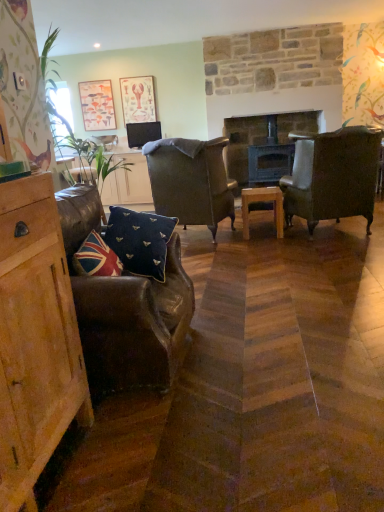
This screenshot has width=384, height=512. Find the location of `leather armchair at center, which appears as the 2th chair when viewed from the front`. leather armchair at center, which appears as the 2th chair when viewed from the front is located at coordinates (332, 175).

Locate an element on the screen. The width and height of the screenshot is (384, 512). dark wood fireplace at center is located at coordinates (242, 143).

The height and width of the screenshot is (512, 384). In order to click on union jack fabric pillow at lower left, the second pillow when ordered from back to front in this screenshot , I will do `click(96, 258)`.

What is the approximate width of matte black tv at center?

matte black tv at center is 4.18 inches wide.

Find the location of a particular element. This screenshot has height=512, width=384. matte paper picture frame at upper center, acting as the 1th picture frame starting from the right is located at coordinates [138, 99].

Identify the location of green leafy plant at left. (70, 124).

From a real-world perspective, which object rests below the other?

From a 3D spatial view, leather wingback chair at center, positioned as the second chair in right-to-left order, is below.

Could you measure the distance between dark wood fireplace at center and leather wingback chair at center, the third chair viewed from the front?

dark wood fireplace at center is 1.51 meters from leather wingback chair at center, the third chair viewed from the front.

At what (x,y) coordinates should I click in order to perform the action: click on chair that is the 1st object located in front of the dark wood fireplace at center. Please return your answer as a coordinate pair (x, y). Looking at the image, I should click on (190, 181).

Based on the photo, who is taller, dark wood fireplace at center or leather wingback chair at center, the 1th chair viewed from the back?

With more height is dark wood fireplace at center.

From a real-world perspective, is leather armchair at left, marked as the 1th chair in a left-to-right arrangement, positioned over wooden picture frame at upper left, the second picture frame when ordered from right to left, based on gravity?

No.

Considering the relative positions of leather armchair at left, marked as the 1th chair in a left-to-right arrangement, and wooden picture frame at upper left, placed as the first picture frame when sorted from left to right, in the image provided, is leather armchair at left, marked as the 1th chair in a left-to-right arrangement, to the right of wooden picture frame at upper left, placed as the first picture frame when sorted from left to right, from the viewer's perspective?

Yes.

Which is less distant, (x=181, y=306) or (x=82, y=102)?

Clearly, point (x=181, y=306) is closer to the camera than point (x=82, y=102).

From the image's perspective, which one is positioned lower, navy velvet cushion at center, which is counted as the 1th pillow, starting from the back, or green leafy plant at left?

navy velvet cushion at center, which is counted as the 1th pillow, starting from the back, is shown below in the image.

Is navy velvet cushion at center, the second pillow when ordered from front to back, wider or thinner than green leafy plant at left?

Considering their sizes, navy velvet cushion at center, the second pillow when ordered from front to back, looks slimmer than green leafy plant at left.

What's the angular difference between navy velvet cushion at center, which is counted as the 1th pillow, starting from the back, and green leafy plant at left's facing directions?

The facing directions of navy velvet cushion at center, which is counted as the 1th pillow, starting from the back, and green leafy plant at left are 95.5 degrees apart.

How much distance is there between navy velvet cushion at center, which is counted as the 1th pillow, starting from the back, and green leafy plant at left?

The distance of navy velvet cushion at center, which is counted as the 1th pillow, starting from the back, from green leafy plant at left is 65.46 centimeters.

Is leather armchair at left, which ranks as the 1th chair in front-to-back order, not close to wooden table at center?

Yes, leather armchair at left, which ranks as the 1th chair in front-to-back order, and wooden table at center are quite far apart.

Is leather armchair at left, which ranks as the 1th chair in front-to-back order, at the left side of wooden table at center?

Yes.

Which is less distant, (92,209) or (277,200)?

Point (92,209) is closer to the camera than point (277,200).

From the image's perspective, is leather armchair at left, marked as the 1th chair in a left-to-right arrangement, positioned above or below wooden table at center?

Clearly, from the image's perspective, leather armchair at left, marked as the 1th chair in a left-to-right arrangement, is below wooden table at center.

Considering the sizes of navy velvet cushion at center, the second pillow when ordered from front to back, and dark wood fireplace at center in the image, is navy velvet cushion at center, the second pillow when ordered from front to back, taller or shorter than dark wood fireplace at center?

navy velvet cushion at center, the second pillow when ordered from front to back, is shorter than dark wood fireplace at center.

From a real-world perspective, which is physically above, navy velvet cushion at center, the second pillow when ordered from front to back, or dark wood fireplace at center?

From a 3D spatial view, dark wood fireplace at center is above.

Locate an element on the screen. fireplace located behind the navy velvet cushion at center, which is counted as the 1th pillow, starting from the back is located at coordinates (242, 143).

Is point (143, 264) closer or farther from the camera than point (301, 119)?

Point (143, 264).

Looking at this image, which object is thinner, union jack fabric pillow at lower left, acting as the first pillow starting from the front, or leather armchair at left, acting as the third chair starting from the back?

union jack fabric pillow at lower left, acting as the first pillow starting from the front, is thinner.

Is union jack fabric pillow at lower left, the second pillow when ordered from back to front, placed right next to leather armchair at left, which ranks as the 1th chair in front-to-back order?

No.

Image resolution: width=384 pixels, height=512 pixels. I want to click on the 2nd pillow positioned above the leather armchair at left, positioned as the 3th chair in right-to-left order (from a real-world perspective), so click(96, 258).

Considering their positions, is union jack fabric pillow at lower left, acting as the first pillow starting from the front, located in front of or behind leather armchair at left, marked as the 1th chair in a left-to-right arrangement?

union jack fabric pillow at lower left, acting as the first pillow starting from the front, is positioned farther from the viewer than leather armchair at left, marked as the 1th chair in a left-to-right arrangement.

What's the angular difference between green leafy plant at left and navy velvet cushion at center, the second pillow when ordered from front to back,'s facing directions?

green leafy plant at left and navy velvet cushion at center, the second pillow when ordered from front to back, are facing 95.5 degrees away from each other.

Is point (45, 85) positioned behind point (155, 273)?

That is True.

Does green leafy plant at left contain navy velvet cushion at center, the second pillow when ordered from front to back?

No.

Does green leafy plant at left lie in front of navy velvet cushion at center, which is counted as the 1th pillow, starting from the back?

No, green leafy plant at left is further to the viewer.

The height and width of the screenshot is (512, 384). Identify the location of fireplace lying behind the leather wingback chair at center, positioned as the second chair in right-to-left order. (242, 143).

Locate an element on the screen. the 3rd chair in front of the wooden picture frame at upper left, the second picture frame when ordered from right to left, counting from the anchor's position is located at coordinates (125, 308).

When comparing their distances from navy velvet cushion at center, which is counted as the 1th pillow, starting from the back, does leather armchair at center, which is the first chair from right to left, or leather armchair at left, acting as the third chair starting from the back, seem further?

leather armchair at center, which is the first chair from right to left, is further to navy velvet cushion at center, which is counted as the 1th pillow, starting from the back.

Which object lies further to the anchor point leather armchair at left, acting as the third chair starting from the back, leather wingback chair at center, the 1th chair viewed from the back, or matte paper picture frame at upper center, acting as the 1th picture frame starting from the right?

matte paper picture frame at upper center, acting as the 1th picture frame starting from the right, lies further to leather armchair at left, acting as the third chair starting from the back, than the other object.

Which object lies nearer to the anchor point leather armchair at center, which is the first chair from right to left, navy velvet cushion at center, the second pillow when ordered from front to back, or union jack fabric pillow at lower left, the second pillow when ordered from back to front?

navy velvet cushion at center, the second pillow when ordered from front to back.

Considering their positions, is navy velvet cushion at center, which is counted as the 1th pillow, starting from the back, positioned further to leather wingback chair at center, positioned as the second chair in right-to-left order, than wooden table at center?

The object further to leather wingback chair at center, positioned as the second chair in right-to-left order, is navy velvet cushion at center, which is counted as the 1th pillow, starting from the back.

Estimate the real-world distances between objects in this image. Which object is further from green leafy plant at left, dark wood fireplace at center or matte black tv at center?

matte black tv at center lies further to green leafy plant at left than the other object.

Looking at the image, which one is located closer to navy velvet cushion at center, which is counted as the 1th pillow, starting from the back, leather wingback chair at center, the 1th chair viewed from the back, or leather armchair at left, acting as the third chair starting from the back?

Among the two, leather armchair at left, acting as the third chair starting from the back, is located nearer to navy velvet cushion at center, which is counted as the 1th pillow, starting from the back.

Based on the photo, considering their positions, is leather wingback chair at center, positioned as the second chair in right-to-left order, positioned closer to dark wood fireplace at center than union jack fabric pillow at lower left, acting as the first pillow starting from the front?

Based on the image, leather wingback chair at center, positioned as the second chair in right-to-left order, appears to be nearer to dark wood fireplace at center.

Considering their positions, is navy velvet cushion at center, which is counted as the 1th pillow, starting from the back, positioned further to leather wingback chair at center, which is counted as the second chair, starting from the left, than green leafy plant at left?

navy velvet cushion at center, which is counted as the 1th pillow, starting from the back, lies further to leather wingback chair at center, which is counted as the second chair, starting from the left, than the other object.

You are a GUI agent. You are given a task and a screenshot of the screen. Output one action in this format:
    pyautogui.click(x=<x>, y=<y>)
    Task: Click on the television between wooden table at center and wooden picture frame at upper left, the second picture frame when ordered from right to left, in the front-back direction
    The height and width of the screenshot is (512, 384).
    Given the screenshot: What is the action you would take?
    pyautogui.click(x=143, y=133)

I want to click on table between leather armchair at left, acting as the third chair starting from the back, and matte black tv at center, along the z-axis, so click(x=262, y=206).

Locate an element on the screen. The image size is (384, 512). television between leather armchair at left, which ranks as the 1th chair in front-to-back order, and matte paper picture frame at upper center, the second picture frame positioned from the left, from front to back is located at coordinates (143, 133).

Where is `picture frame between green leafy plant at left and wooden picture frame at upper left, the second picture frame when ordered from right to left, from front to back`? Image resolution: width=384 pixels, height=512 pixels. picture frame between green leafy plant at left and wooden picture frame at upper left, the second picture frame when ordered from right to left, from front to back is located at coordinates (138, 99).